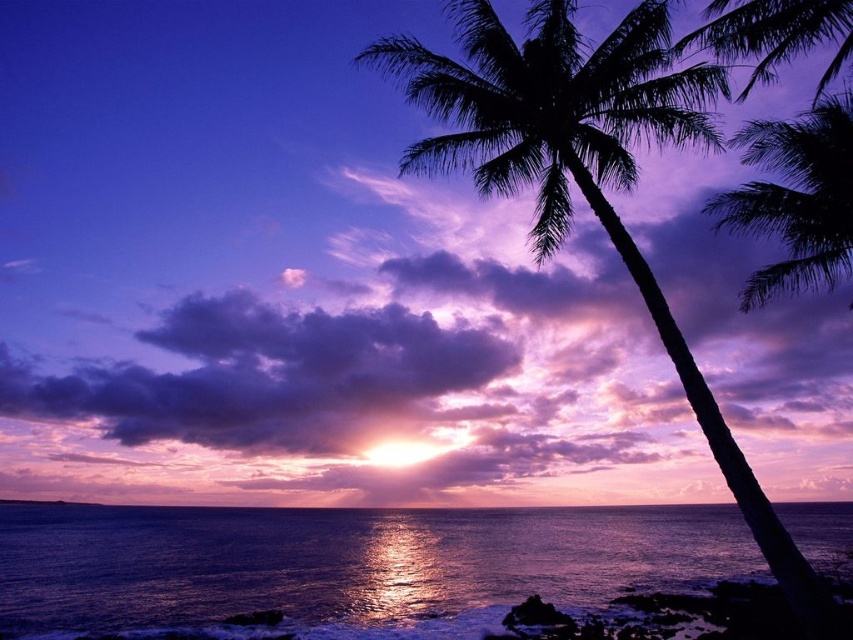
Question: Which of these objects is positioned closest to the glistening dark blue water at lower center?

Choices:
 (A) purple cloud at upper center
 (B) purple fluffy cloud at upper center
 (C) silhouette leafy palm at upper right
 (D) silhouette palm tree at right

Answer: (B)

Question: Which of the following is the farthest from the observer?

Choices:
 (A) silhouette leafy palm at upper right
 (B) silhouette palm tree at right

Answer: (A)

Question: Is silhouette palm tree at right smaller than purple fluffy cloud at upper center?

Choices:
 (A) yes
 (B) no

Answer: (A)

Question: From the image, what is the correct spatial relationship of purple cloud at upper center in relation to purple fluffy cloud at upper center?

Choices:
 (A) left
 (B) right

Answer: (B)

Question: Which of the following is the closest to the observer?

Choices:
 (A) (349, 400)
 (B) (827, 602)
 (C) (752, 230)
 (D) (363, 515)

Answer: (B)

Question: Is purple cloud at upper center below silhouette palm tree at right?

Choices:
 (A) no
 (B) yes

Answer: (B)